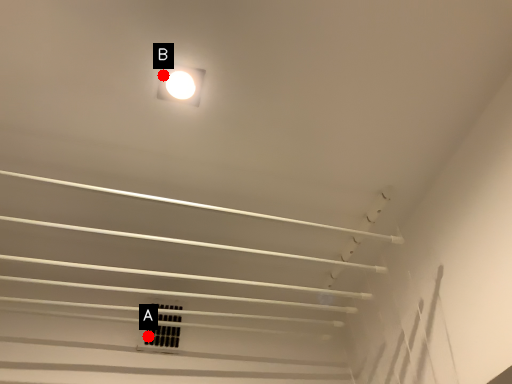
Question: Two points are circled on the image, labeled by A and B beside each circle. Among these points, which one is nearest to the camera?

Choices:
 (A) A is closer
 (B) B is closer

Answer: (B)